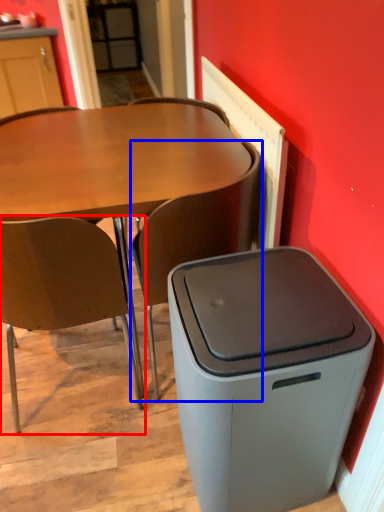
Question: Among these objects, which one is nearest to the camera, chair (highlighted by a red box) or chair (highlighted by a blue box)?

Choices:
 (A) chair
 (B) chair

Answer: (A)